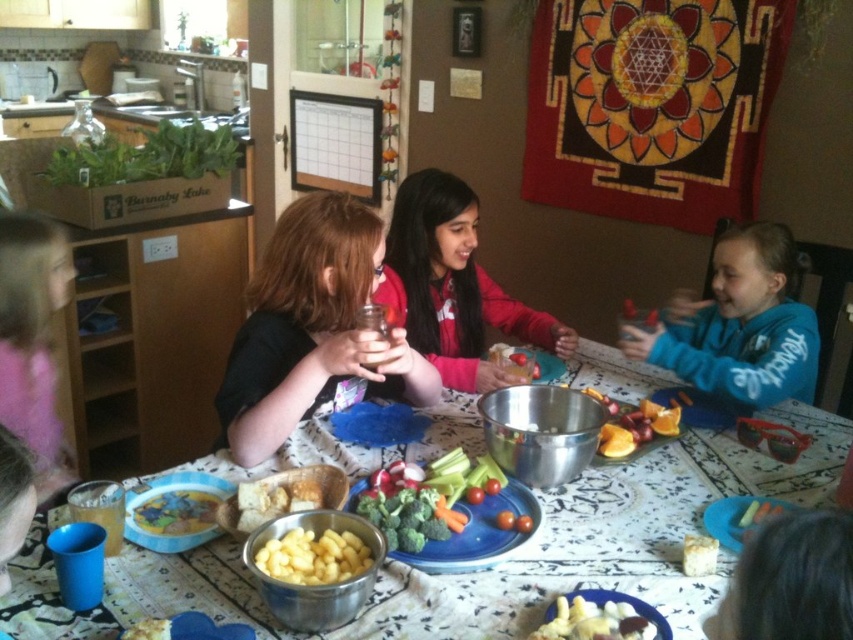
Question: Observing the image, what is the correct spatial positioning of yellow matte cheese at lower center in reference to yellow rubber duck at center?

Choices:
 (A) below
 (B) above

Answer: (A)

Question: Is metallic silver bowl at center bigger than yellow matte cheese at lower center?

Choices:
 (A) no
 (B) yes

Answer: (B)

Question: Which of the following is the farthest from the observer?

Choices:
 (A) (376, 522)
 (B) (689, 557)
 (C) (735, 244)

Answer: (C)

Question: Considering the relative positions of matte black shirt at center and smooth chocolate bar at center in the image provided, where is matte black shirt at center located with respect to smooth chocolate bar at center?

Choices:
 (A) below
 (B) above

Answer: (B)

Question: Among these objects, which one is nearest to the camera?

Choices:
 (A) yellow rubber duck at center
 (B) yellow matte cheese at lower center
 (C) matte red jacket at center

Answer: (B)

Question: Which of the following is the farthest from the observer?

Choices:
 (A) orange fleshed fruit at center
 (B) green broccoli at center
 (C) yellow rubber duck at center

Answer: (A)